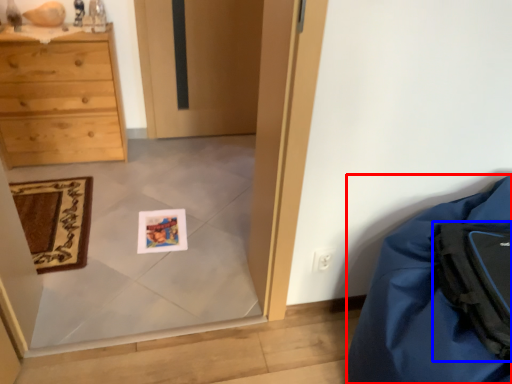
Question: Which point is further to the camera, furniture (highlighted by a red box) or backpack (highlighted by a blue box)?

Choices:
 (A) furniture
 (B) backpack

Answer: (B)